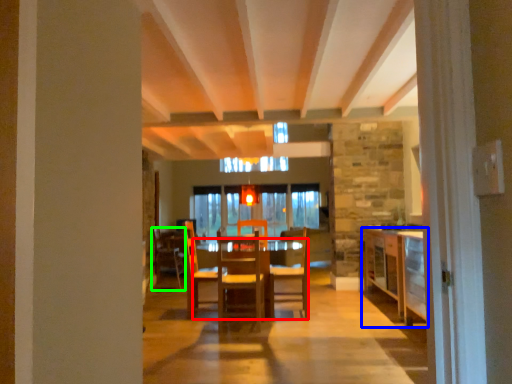
Question: Considering the real-world distances, which object is closest to table (highlighted by a red box)? cabinetry (highlighted by a blue box) or chair (highlighted by a green box).

Choices:
 (A) cabinetry
 (B) chair

Answer: (A)